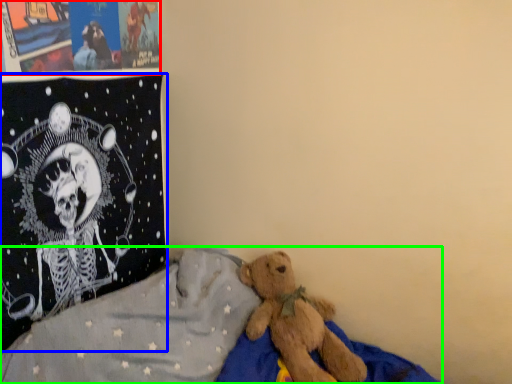
Question: Considering the real-world distances, which object is farthest from poster page (highlighted by a red box)? pillow (highlighted by a blue box) or bed (highlighted by a green box)?

Choices:
 (A) pillow
 (B) bed

Answer: (B)